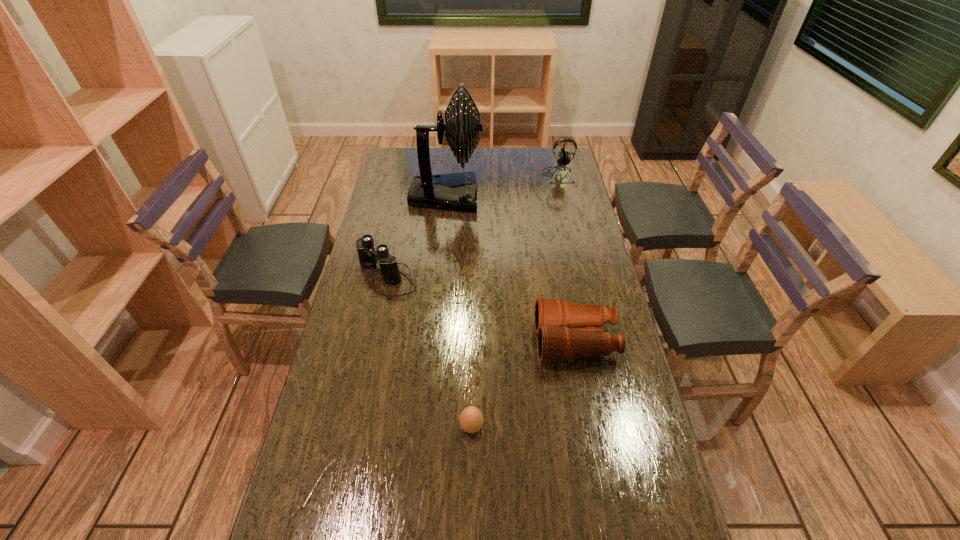
Where is `the tallest object`? the tallest object is located at coordinates (457, 191).

Image resolution: width=960 pixels, height=540 pixels. In order to click on earphone in this screenshot , I will do pos(563,157).

Locate an element on the screen. The width and height of the screenshot is (960, 540). the left binoculars is located at coordinates (368, 256).

This screenshot has height=540, width=960. Identify the location of the third farthest object. (368, 256).

I want to click on the right binoculars, so click(560, 325).

Find the location of a particular element. This screenshot has width=960, height=540. the nearer binoculars is located at coordinates (560, 325).

The height and width of the screenshot is (540, 960). In order to click on the shortest object in this screenshot , I will do `click(471, 419)`.

This screenshot has width=960, height=540. Find the location of `boiled egg`. boiled egg is located at coordinates [x=471, y=419].

You are a GUI agent. You are given a task and a screenshot of the screen. Output one action in this format:
    pyautogui.click(x=<x>, y=<y>)
    Task: Click on the vacant space located 0.050m in front of the tallest object to blow air
    
    Given the screenshot: What is the action you would take?
    pyautogui.click(x=494, y=195)

Identify the location of vacant space located 0.320m on the front of the earphone. (569, 228).